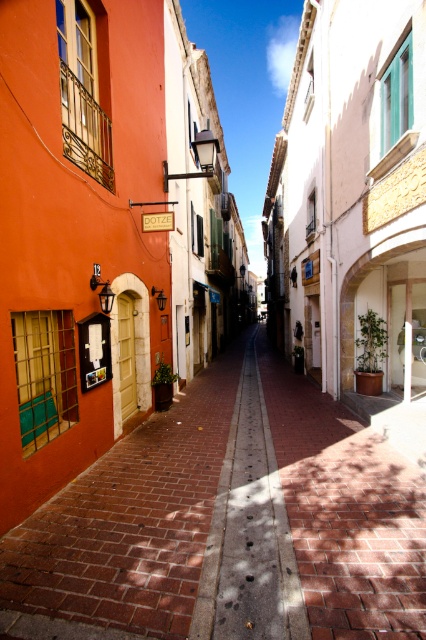
Who is positioned more to the right, smooth brick pavement at center or brick pavement at center?

smooth brick pavement at center is more to the right.

Is smooth brick pavement at center in front of brick pavement at center?

Yes, it is in front of brick pavement at center.

What do you see at coordinates (345, 512) in the screenshot?
I see `smooth brick pavement at center` at bounding box center [345, 512].

Find the location of a particular element. smooth brick pavement at center is located at coordinates (345, 512).